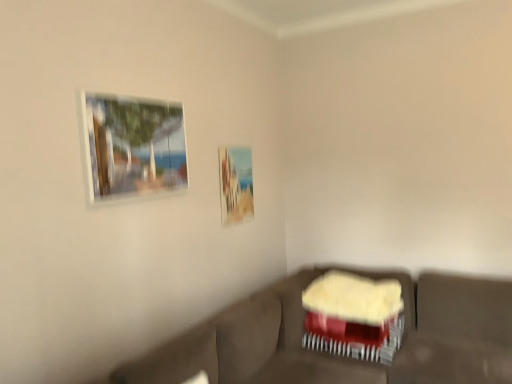
Question: Is matte glass picture frame at upper left, the second picture frame when ordered from back to front, surrounded by velvet brown couch at lower center?

Choices:
 (A) yes
 (B) no

Answer: (B)

Question: Does velvet brown couch at lower center appear on the left side of matte glass picture frame at upper left, the 1th picture frame positioned from the left?

Choices:
 (A) yes
 (B) no

Answer: (B)

Question: Considering the relative sizes of velvet brown couch at lower center and matte glass picture frame at upper left, the second picture frame when ordered from back to front, in the image provided, is velvet brown couch at lower center bigger than matte glass picture frame at upper left, the second picture frame when ordered from back to front,?

Choices:
 (A) yes
 (B) no

Answer: (A)

Question: Considering the relative positions of velvet brown couch at lower center and matte glass picture frame at upper left, the second picture frame positioned from the right, in the image provided, is velvet brown couch at lower center in front of matte glass picture frame at upper left, the second picture frame positioned from the right,?

Choices:
 (A) yes
 (B) no

Answer: (A)

Question: From a real-world perspective, is velvet brown couch at lower center beneath matte glass picture frame at upper left, the second picture frame when ordered from back to front?

Choices:
 (A) yes
 (B) no

Answer: (A)

Question: From the image's perspective, is velvet brown couch at lower center located above matte glass picture frame at upper left, the second picture frame positioned from the right?

Choices:
 (A) yes
 (B) no

Answer: (B)

Question: Does velvet red swivel chair at lower right touch velvet brown couch at lower center?

Choices:
 (A) yes
 (B) no

Answer: (B)

Question: Does velvet red swivel chair at lower right have a greater width compared to velvet brown couch at lower center?

Choices:
 (A) no
 (B) yes

Answer: (A)

Question: Is velvet brown couch at lower center completely or partially inside velvet red swivel chair at lower right?

Choices:
 (A) yes
 (B) no

Answer: (B)

Question: Is velvet red swivel chair at lower right thinner than velvet brown couch at lower center?

Choices:
 (A) no
 (B) yes

Answer: (B)

Question: Would you say velvet red swivel chair at lower right is a long distance from velvet brown couch at lower center?

Choices:
 (A) yes
 (B) no

Answer: (B)

Question: From the image's perspective, is velvet red swivel chair at lower right under velvet brown couch at lower center?

Choices:
 (A) no
 (B) yes

Answer: (A)

Question: Can you confirm if velvet red swivel chair at lower right is positioned to the left of matte glass picture frame at upper left, the 1th picture frame positioned from the left?

Choices:
 (A) yes
 (B) no

Answer: (B)